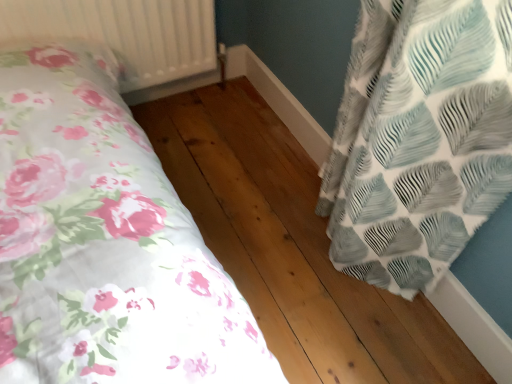
The width and height of the screenshot is (512, 384). Describe the element at coordinates (124, 33) in the screenshot. I see `white textured radiator at upper left` at that location.

I want to click on white textured radiator at upper left, so click(x=124, y=33).

Locate an element on the screen. The height and width of the screenshot is (384, 512). natural wood flooring at center is located at coordinates (291, 247).

Image resolution: width=512 pixels, height=384 pixels. What do you see at coordinates (291, 247) in the screenshot? I see `natural wood flooring at center` at bounding box center [291, 247].

Locate an element on the screen. The width and height of the screenshot is (512, 384). white textured radiator at upper left is located at coordinates (124, 33).

Which object is positioned more to the right, white textured radiator at upper left or natural wood flooring at center?

natural wood flooring at center is more to the right.

Is white textured radiator at upper left in front of natural wood flooring at center?

No, white textured radiator at upper left is further to the viewer.

Which is less distant, [117,4] or [287,357]?

Positioned in front is point [287,357].

From the image's perspective, is white textured radiator at upper left on natural wood flooring at center?

Yes, from the image's perspective, white textured radiator at upper left is on top of natural wood flooring at center.

From a real-world perspective, relative to natural wood flooring at center, is white textured radiator at upper left vertically above or below?

In terms of real-world spatial position, white textured radiator at upper left is above natural wood flooring at center.

Between white textured radiator at upper left and natural wood flooring at center, which one has smaller width?

With smaller width is natural wood flooring at center.

Looking at this image, does white textured radiator at upper left have a lesser height compared to natural wood flooring at center?

In fact, white textured radiator at upper left may be taller than natural wood flooring at center.

Does white textured radiator at upper left have a smaller size compared to natural wood flooring at center?

Incorrect, white textured radiator at upper left is not smaller in size than natural wood flooring at center.

Is white textured radiator at upper left outside of natural wood flooring at center?

Yes, white textured radiator at upper left is located beyond the bounds of natural wood flooring at center.

Would you consider white textured radiator at upper left to be distant from natural wood flooring at center?

No.

Is white textured radiator at upper left oriented away from natural wood flooring at center?

No.

How different are the orientations of white textured radiator at upper left and natural wood flooring at center in degrees?

The facing directions of white textured radiator at upper left and natural wood flooring at center are 90.1 degrees apart.

How much distance is there between white textured radiator at upper left and natural wood flooring at center?

white textured radiator at upper left is 56.93 centimeters from natural wood flooring at center.

The width and height of the screenshot is (512, 384). Identify the location of hardwood on the right of white textured radiator at upper left. (291, 247).

Between natural wood flooring at center and white textured radiator at upper left, which one appears on the right side from the viewer's perspective?

Positioned to the right is natural wood flooring at center.

Is natural wood flooring at center further to camera compared to white textured radiator at upper left?

No, natural wood flooring at center is closer to the camera.

Does point (295, 200) appear closer or farther from the camera than point (162, 12)?

Point (295, 200) appears to be farther away from the viewer than point (162, 12).

From the image's perspective, between natural wood flooring at center and white textured radiator at upper left, which one is located above?

white textured radiator at upper left.

From a real-world perspective, is natural wood flooring at center above or below white textured radiator at upper left?

Clearly, from a real-world perspective, natural wood flooring at center is below white textured radiator at upper left.

Can you confirm if natural wood flooring at center is thinner than white textured radiator at upper left?

Indeed, natural wood flooring at center has a lesser width compared to white textured radiator at upper left.

Considering the sizes of objects natural wood flooring at center and white textured radiator at upper left in the image provided, who is shorter, natural wood flooring at center or white textured radiator at upper left?

natural wood flooring at center is shorter.

From the picture: Does natural wood flooring at center have a smaller size compared to white textured radiator at upper left?

Indeed, natural wood flooring at center has a smaller size compared to white textured radiator at upper left.

Is white textured radiator at upper left surrounded by natural wood flooring at center?

No, white textured radiator at upper left is not a part of natural wood flooring at center.

Is natural wood flooring at center in contact with white textured radiator at upper left?

No, natural wood flooring at center is not next to white textured radiator at upper left.

Could you tell me if natural wood flooring at center is turned towards white textured radiator at upper left?

No, natural wood flooring at center is not oriented towards white textured radiator at upper left.

How far apart are natural wood flooring at center and white textured radiator at upper left?

natural wood flooring at center is 22.41 inches away from white textured radiator at upper left.

Where is `radiator on the left of natural wood flooring at center`? radiator on the left of natural wood flooring at center is located at coordinates (124, 33).

You are a GUI agent. You are given a task and a screenshot of the screen. Output one action in this format:
    pyautogui.click(x=<x>, y=<y>)
    Task: Click on the radiator that is behind the natural wood flooring at center
    This screenshot has width=512, height=384.
    Given the screenshot: What is the action you would take?
    pyautogui.click(x=124, y=33)

At what (x,y) coordinates should I click in order to perform the action: click on radiator above the natural wood flooring at center (from a real-world perspective). Please return your answer as a coordinate pair (x, y). This screenshot has width=512, height=384. Looking at the image, I should click on (124, 33).